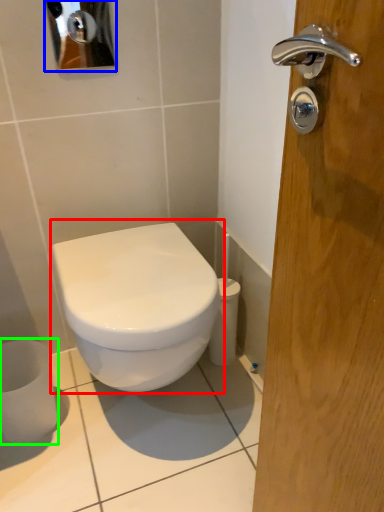
Question: Estimate the real-world distances between objects in this image. Which object is closer to toilet (highlighted by a red box), mirror (highlighted by a blue box) or toilet paper (highlighted by a green box)?

Choices:
 (A) mirror
 (B) toilet paper

Answer: (B)